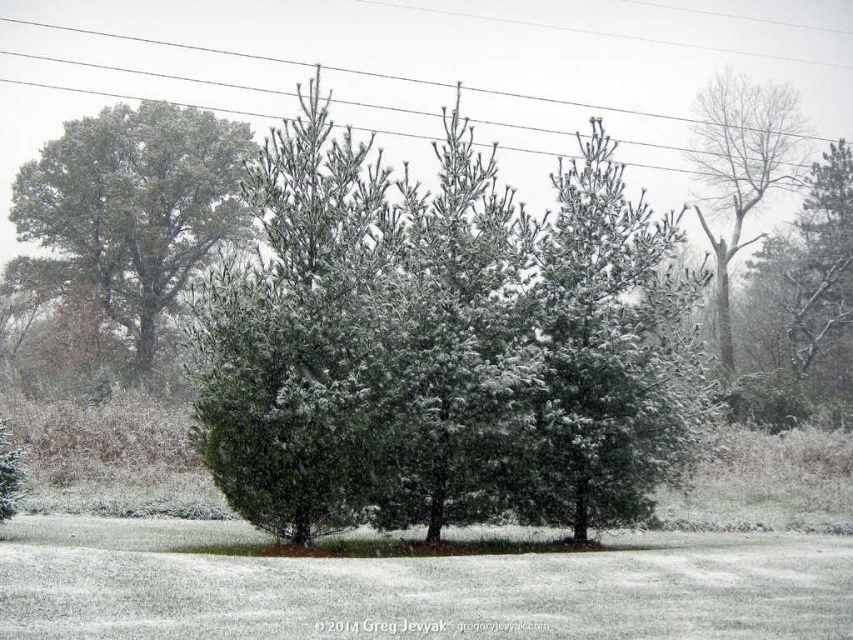
You are standing in the winter scene and see a point marked at coordinates (444, 342). What object is located at that point?

The point at coordinates (444, 342) marks the green matte evergreen at center.